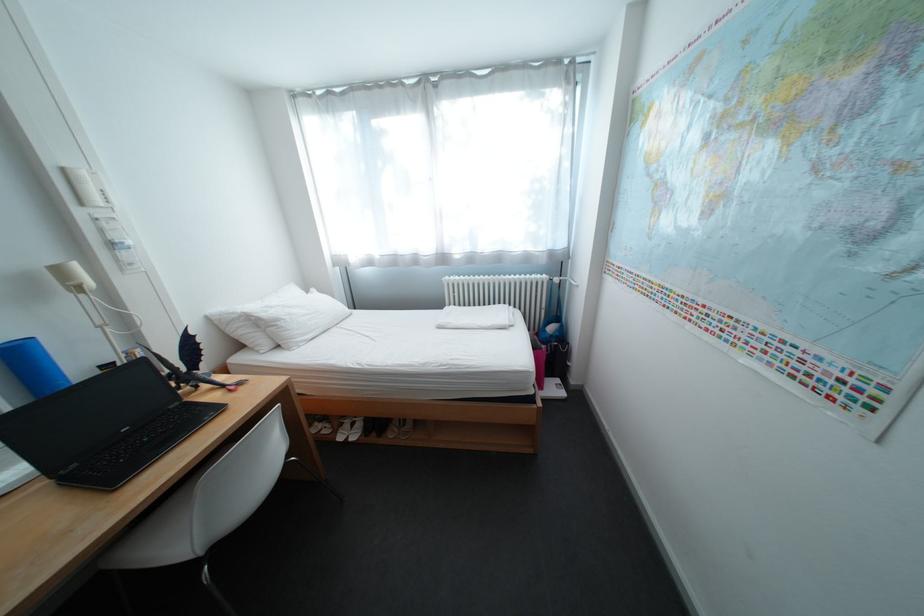
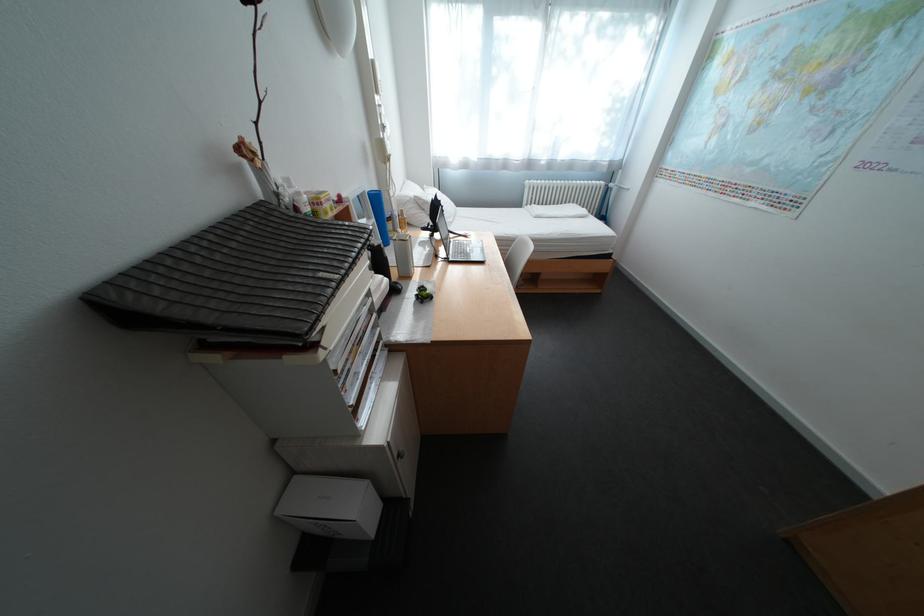
The point at (248,317) is marked in the first image. Where is the corresponding point in the second image?

(420, 200)